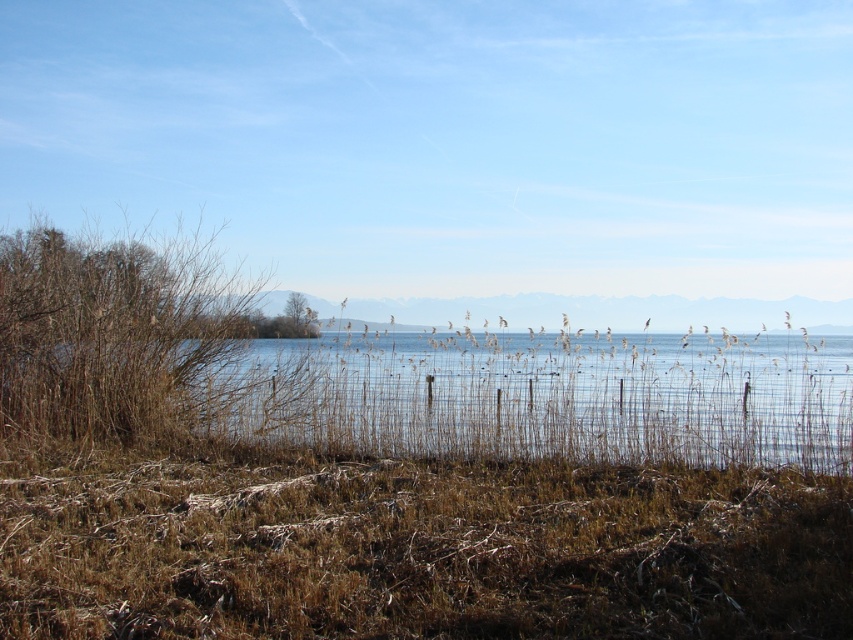
Question: Among these objects, which one is farthest from the camera?

Choices:
 (A) brown dry grass at left
 (B) clear water at center

Answer: (A)

Question: Which object is closer to the camera taking this photo?

Choices:
 (A) brown dry grass at lower center
 (B) clear water at center
 (C) brown dry grass at left

Answer: (A)

Question: Can you confirm if brown dry grass at lower center is smaller than brown dry grass at left?

Choices:
 (A) yes
 (B) no

Answer: (B)

Question: Where is brown dry grass at lower center located in relation to clear water at center in the image?

Choices:
 (A) above
 (B) below

Answer: (B)

Question: Which object appears farthest from the camera in this image?

Choices:
 (A) brown dry grass at lower center
 (B) brown dry grass at left
 (C) clear water at center

Answer: (B)

Question: Observing the image, what is the correct spatial positioning of clear water at center in reference to brown dry grass at left?

Choices:
 (A) left
 (B) right

Answer: (B)